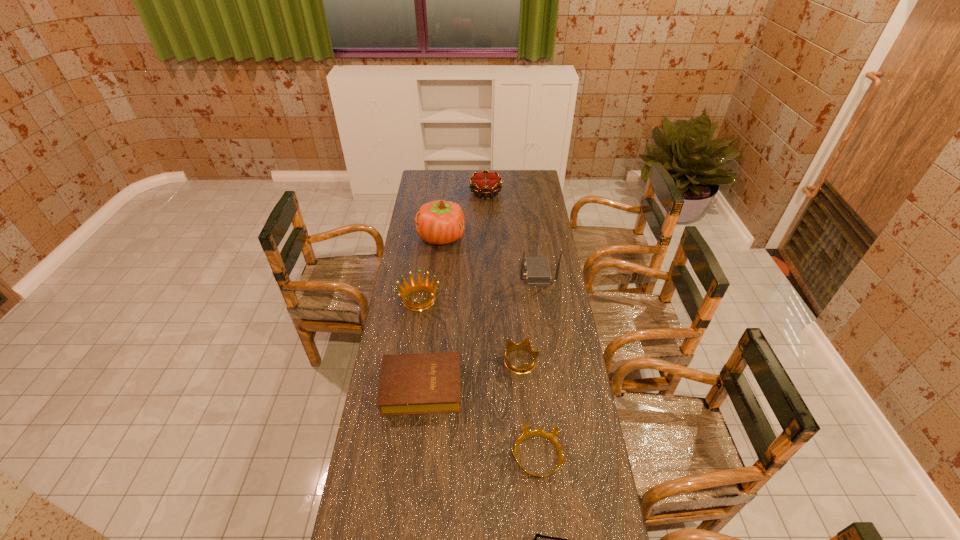
Point out which object is positioned as the third nearest to the second farthest object. Please provide its 2D coordinates. Your answer should be formatted as a tuple, i.e. [(x, y)], where the tuple contains the x and y coordinates of a point satisfying the conditions above.

[(537, 273)]

You are a GUI agent. You are given a task and a screenshot of the screen. Output one action in this format:
    pyautogui.click(x=<x>, y=<y>)
    Task: Click on the closest crown to the farthest crown
    This screenshot has height=540, width=960.
    Given the screenshot: What is the action you would take?
    pyautogui.click(x=420, y=286)

Identify which crown is located as the third nearest to the Bible. Please provide its 2D coordinates. Your answer should be formatted as a tuple, i.e. [(x, y)], where the tuple contains the x and y coordinates of a point satisfying the conditions above.

[(420, 286)]